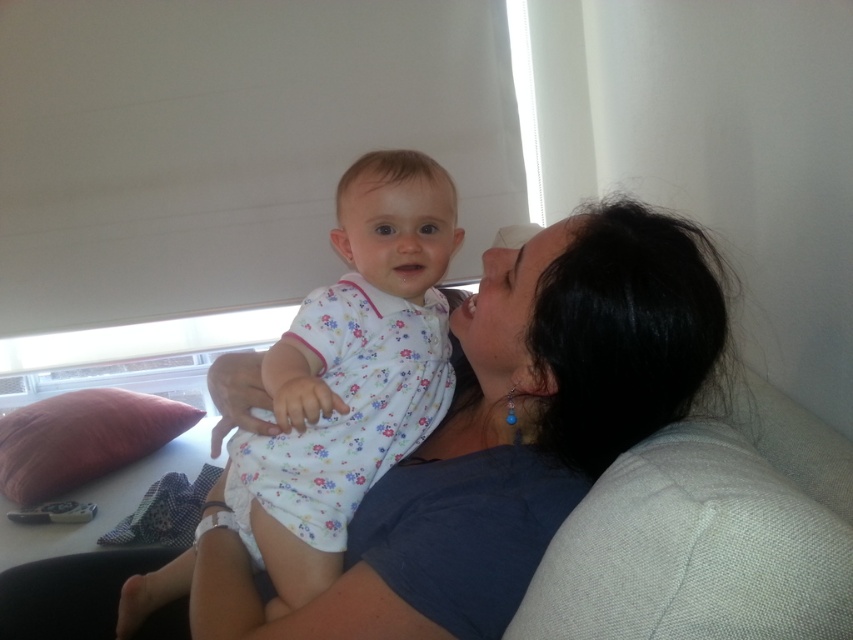
Question: Which of the following is the closest to the observer?

Choices:
 (A) (73, 476)
 (B) (561, 444)

Answer: (B)

Question: Does blue fabric at upper center lie in front of white floral dress at center?

Choices:
 (A) no
 (B) yes

Answer: (B)

Question: Is blue fabric at upper center thinner than white floral dress at center?

Choices:
 (A) yes
 (B) no

Answer: (B)

Question: Which of the following is the farthest from the observer?

Choices:
 (A) (575, 387)
 (B) (271, 346)
 (C) (67, 460)

Answer: (C)

Question: In this image, where is white floral dress at center located relative to pink fabric pillow at left?

Choices:
 (A) below
 (B) above

Answer: (B)

Question: Which point is farther from the camera taking this photo?

Choices:
 (A) (59, 465)
 (B) (444, 568)

Answer: (A)